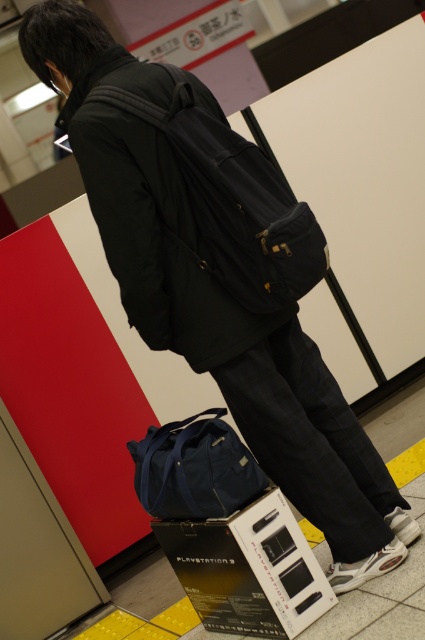
Is point (308, 236) closer to viewer compared to point (201, 506)?

Yes, point (308, 236) is in front of point (201, 506).

Who is more distant from viewer, (277, 301) or (158, 506)?

The point (158, 506) is more distant.

Does point (248, 236) lie behind point (155, 484)?

No, (248, 236) is in front of (155, 484).

Find the location of a particular element. The image size is (425, 640). black fabric backpack at center is located at coordinates (232, 202).